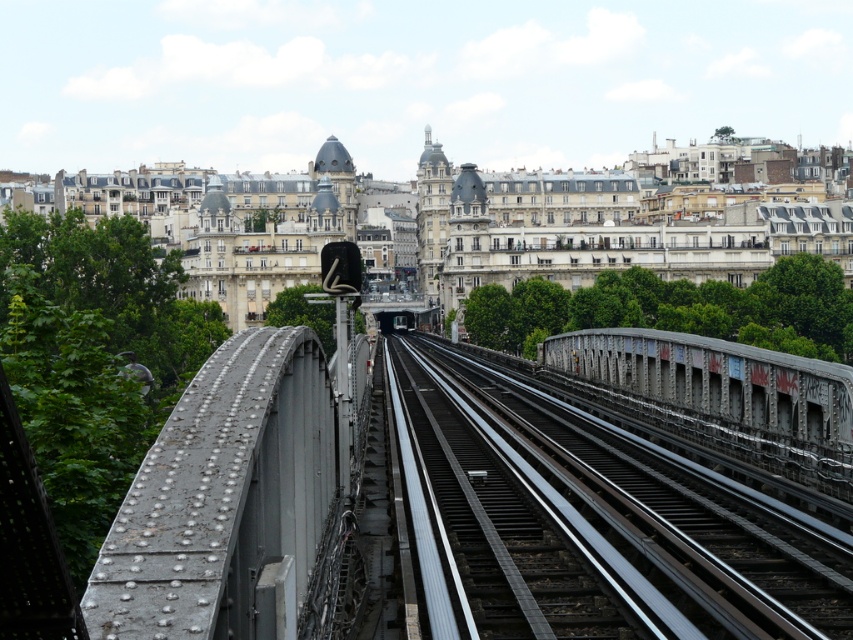
Based on the photo, can you confirm if metal/rough track at center is positioned to the right of rusty metal bridge at center?

No, metal/rough track at center is not to the right of rusty metal bridge at center.

Which is more to the left, metal/rough track at center or rusty metal bridge at center?

metal/rough track at center is more to the left.

Image resolution: width=853 pixels, height=640 pixels. In order to click on metal/rough track at center in this screenshot , I will do `click(637, 516)`.

This screenshot has width=853, height=640. Find the location of `metal/rough track at center`. metal/rough track at center is located at coordinates (637, 516).